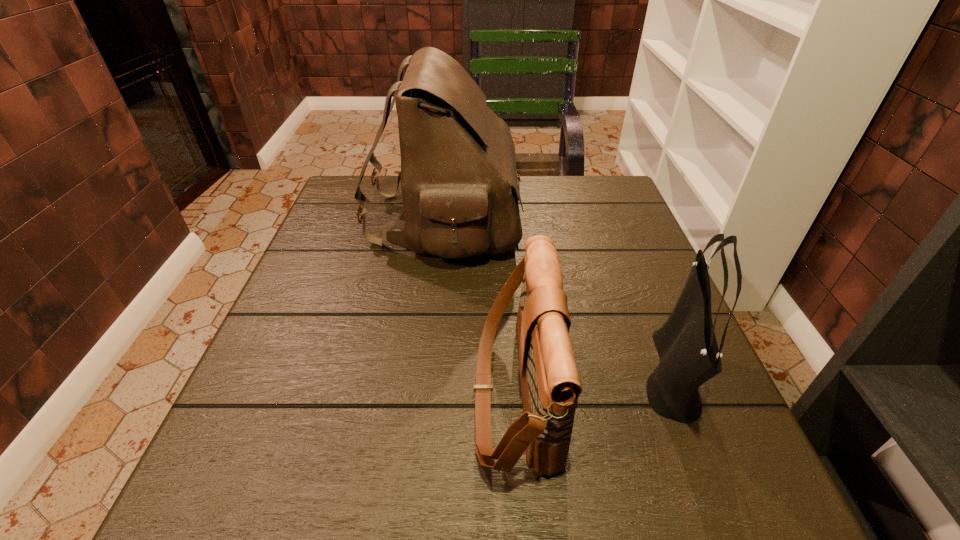
Image resolution: width=960 pixels, height=540 pixels. Find the location of `the farthest object`. the farthest object is located at coordinates (459, 184).

This screenshot has height=540, width=960. I want to click on the tallest object, so click(x=459, y=184).

Locate an element on the screen. Image resolution: width=960 pixels, height=540 pixels. the taller shoulder bag is located at coordinates (686, 344).

You are a GUI agent. You are given a task and a screenshot of the screen. Output one action in this format:
    pyautogui.click(x=<x>, y=<y>)
    Task: Click on the rightmost object
    This screenshot has width=960, height=540.
    Given the screenshot: What is the action you would take?
    pyautogui.click(x=686, y=344)

Locate an element on the screen. Image resolution: width=960 pixels, height=540 pixels. the shortest object is located at coordinates (550, 383).

You are a GUI agent. You are given a task and a screenshot of the screen. Output one action in this format:
    pyautogui.click(x=<x>, y=<y>)
    Task: Click on the left shoulder bag
    The width and height of the screenshot is (960, 540).
    Given the screenshot: What is the action you would take?
    pyautogui.click(x=550, y=383)

Locate an element on the screen. vacant space located 0.170m on the front flap of the satchel is located at coordinates (581, 220).

At what (x,y) coordinates should I click in order to perform the action: click on free space located 0.250m on the left of the rightmost object. Please return your answer as a coordinate pair (x, y). The image size is (960, 540). Looking at the image, I should click on (503, 375).

Locate an element on the screen. vacant space situated 0.240m on the front-facing side of the shorter shoulder bag is located at coordinates (337, 393).

Image resolution: width=960 pixels, height=540 pixels. I want to click on free spot located on the front-facing side of the shorter shoulder bag, so click(x=428, y=393).